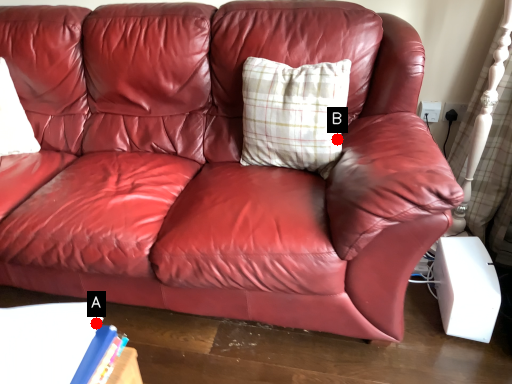
Question: Two points are circled on the image, labeled by A and B beside each circle. Which point is farther to the camera?

Choices:
 (A) A is further
 (B) B is further

Answer: (B)